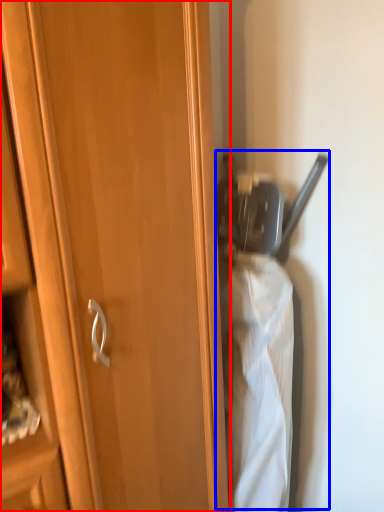
Question: Which point is closer to the camera, cupboard (highlighted by a red box) or wide (highlighted by a blue box)?

Choices:
 (A) cupboard
 (B) wide

Answer: (A)